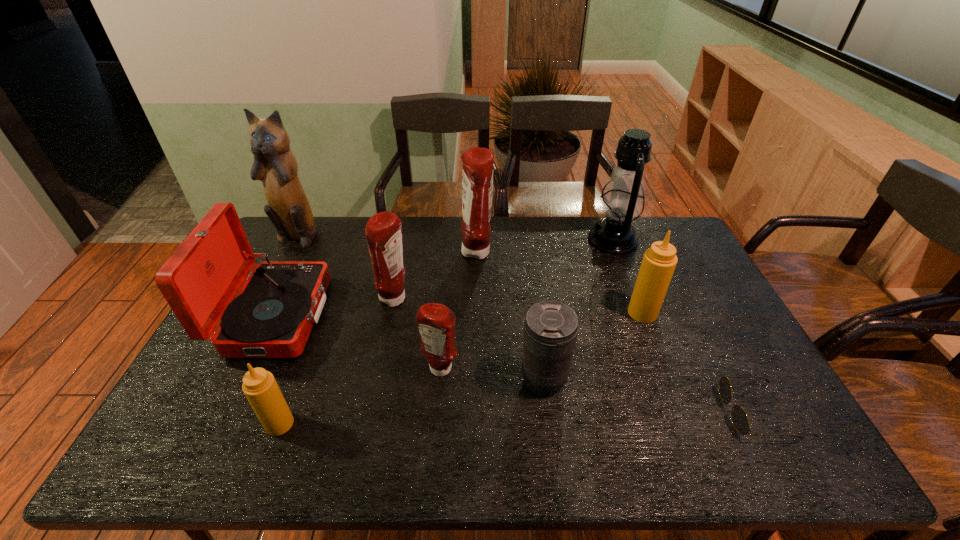
Image resolution: width=960 pixels, height=540 pixels. I want to click on vacant region between the phonograph_record and the oil lamp, so click(444, 278).

I want to click on vacant area that lies between the smaller tan condiment and the smallest red condiment, so tap(360, 397).

I want to click on free space between the gray sunglasses and the leftmost condiment, so click(x=516, y=418).

Where is `empty location between the biggest red condiment and the oil lamp`? The image size is (960, 540). empty location between the biggest red condiment and the oil lamp is located at coordinates (544, 246).

At what (x,y) coordinates should I click in order to perform the action: click on object that is the third closest one to the smallest red condiment. Please return your answer as a coordinate pair (x, y). The image size is (960, 540). Looking at the image, I should click on (259, 386).

In order to click on object that ranks as the sixth closest to the nearest red condiment in this screenshot , I will do `click(659, 261)`.

Where is `condiment that can be found as the second closest to the cat`? condiment that can be found as the second closest to the cat is located at coordinates (477, 175).

Locate an element on the screen. condiment that is the fifth closest to the sunglasses is located at coordinates (259, 386).

Identify which red condiment is the closest to the telephoto lens. Please provide its 2D coordinates. Your answer should be formatted as a tuple, i.e. [(x, y)], where the tuple contains the x and y coordinates of a point satisfying the conditions above.

[(436, 322)]

Locate an element on the screen. The width and height of the screenshot is (960, 540). red condiment identified as the closest to the smaller tan condiment is located at coordinates (436, 322).